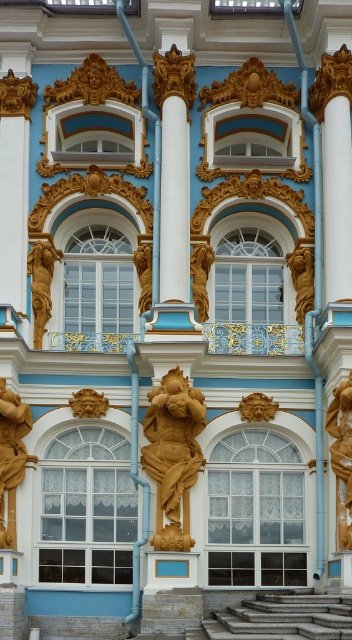
You are an architect analyzing the symmetry of the building facade. Given the central vertical column and the two arched windows on either side, where would you expect the gold polished statue at left to be positioned relative to the central column? Is it to the left or right of the column?

The gold polished statue at left is positioned to the left of the central column, as indicated by its coordinates at point (x=10, y=452). This placement maintains the symmetrical design of the facade with the central column as the axis.

You are an art conservator examining the facade of this ornate building. You need to inspect both the gold polished statue at left and the gold polished statue at center. Based on their positions, which statue would require a ladder to reach first?

The gold polished statue at left is located above the gold polished statue at center, so you would need to use a ladder to reach the gold polished statue at left first since it is higher up.